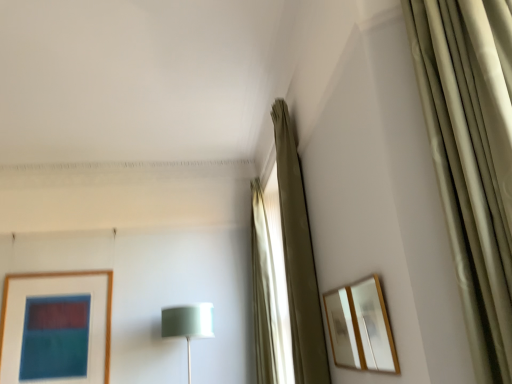
Image resolution: width=512 pixels, height=384 pixels. What do you see at coordinates (263, 291) in the screenshot? I see `beige fabric curtain at center, which ranks as the 1th curtain in back-to-front order` at bounding box center [263, 291].

The height and width of the screenshot is (384, 512). Describe the element at coordinates (298, 257) in the screenshot. I see `beige fabric curtain at upper right, acting as the second curtain starting from the back` at that location.

Find the location of a particular element. This screenshot has height=384, width=512. wooden mirror at upper right, arranged as the 2th picture frame when viewed from the front is located at coordinates (341, 329).

How different are the orientations of wooden-framed mirror at right, the first picture frame positioned from the front, and beige fabric curtain at upper right, acting as the first curtain starting from the front, in degrees?

wooden-framed mirror at right, the first picture frame positioned from the front, and beige fabric curtain at upper right, acting as the first curtain starting from the front, are facing 1.86 degrees away from each other.

Is wooden-framed mirror at right, the first picture frame positioned from the front, to the right of beige fabric curtain at upper right, acting as the first curtain starting from the front, from the viewer's perspective?

Correct, you'll find wooden-framed mirror at right, the first picture frame positioned from the front, to the right of beige fabric curtain at upper right, acting as the first curtain starting from the front.

Which object is further away from the camera taking this photo, wooden-framed mirror at right, the second picture frame positioned from the back, or beige fabric curtain at upper right, acting as the second curtain starting from the back?

beige fabric curtain at upper right, acting as the second curtain starting from the back.

Is point (208, 314) behind point (298, 290)?

Yes, point (208, 314) is behind point (298, 290).

Between satin green shade at center and beige fabric curtain at upper right, acting as the first curtain starting from the front, which one has smaller size?

With smaller size is beige fabric curtain at upper right, acting as the first curtain starting from the front.

Could you tell me if satin green shade at center is facing beige fabric curtain at upper right, acting as the second curtain starting from the back?

No, satin green shade at center is not aimed at beige fabric curtain at upper right, acting as the second curtain starting from the back.

Identify the location of table lamp below the beige fabric curtain at upper right, acting as the first curtain starting from the front (from a real-world perspective). (187, 324).

Where is `table lamp lying on the left of wooden-framed mirror at right, the first picture frame positioned from the front`? table lamp lying on the left of wooden-framed mirror at right, the first picture frame positioned from the front is located at coordinates (187, 324).

Is satin green shade at center behind wooden-framed mirror at right, the first picture frame positioned from the front?

Yes, it is behind wooden-framed mirror at right, the first picture frame positioned from the front.

Can you confirm if satin green shade at center is positioned to the left of wooden-framed mirror at right, the second picture frame positioned from the back?

Yes.

Does point (276, 300) come behind point (186, 321)?

Yes.

From a real-world perspective, which is physically above, beige fabric curtain at center, which ranks as the 1th curtain in back-to-front order, or satin green shade at center?

beige fabric curtain at center, which ranks as the 1th curtain in back-to-front order, from a real-world perspective.

Based on the photo, which of these two, beige fabric curtain at center, which is the second curtain from front to back, or satin green shade at center, is thinner?

beige fabric curtain at center, which is the second curtain from front to back.

Considering the relative sizes of beige fabric curtain at upper right, acting as the second curtain starting from the back, and satin green shade at center in the image provided, is beige fabric curtain at upper right, acting as the second curtain starting from the back, thinner than satin green shade at center?

Correct, the width of beige fabric curtain at upper right, acting as the second curtain starting from the back, is less than that of satin green shade at center.

Between beige fabric curtain at upper right, acting as the first curtain starting from the front, and satin green shade at center, which one has larger size?

satin green shade at center is bigger.

The image size is (512, 384). Identify the location of table lamp that appears below the beige fabric curtain at upper right, acting as the first curtain starting from the front (from the image's perspective). (187, 324).

Is wooden-framed mirror at right, the second picture frame positioned from the back, aimed at satin green shade at center?

No, wooden-framed mirror at right, the second picture frame positioned from the back, is not oriented towards satin green shade at center.

From the image's perspective, is wooden-framed mirror at right, the first picture frame positioned from the front, beneath satin green shade at center?

No.

Which is closer, (380,364) or (196,335)?

The point (380,364) is closer.

Between wooden-framed mirror at right, the first picture frame positioned from the front, and satin green shade at center, which one has smaller width?

wooden-framed mirror at right, the first picture frame positioned from the front.

Which is in front, beige fabric curtain at upper right, acting as the first curtain starting from the front, or wooden mirror at upper right, arranged as the 2th picture frame when viewed from the front?

wooden mirror at upper right, arranged as the 2th picture frame when viewed from the front, is closer to the camera.

Which object is wider, beige fabric curtain at upper right, acting as the first curtain starting from the front, or wooden mirror at upper right, arranged as the 2th picture frame when viewed from the front?

With larger width is beige fabric curtain at upper right, acting as the first curtain starting from the front.

From the image's perspective, is beige fabric curtain at upper right, acting as the second curtain starting from the back, below wooden mirror at upper right, which is the 1th picture frame from back to front?

No, from the image's perspective, beige fabric curtain at upper right, acting as the second curtain starting from the back, is not beneath wooden mirror at upper right, which is the 1th picture frame from back to front.

Which curtain is the 1st one when counting from the back of the wooden-framed mirror at right, the second picture frame positioned from the back? Please provide its 2D coordinates.

[(298, 257)]

Locate an element on the screen. The image size is (512, 384). table lamp that appears on the left of beige fabric curtain at upper right, acting as the second curtain starting from the back is located at coordinates (187, 324).

When comparing their distances from beige fabric curtain at center, which ranks as the 1th curtain in back-to-front order, does wooden mirror at upper right, arranged as the 2th picture frame when viewed from the front, or beige fabric curtain at upper right, acting as the second curtain starting from the back, seem closer?

Among the two, beige fabric curtain at upper right, acting as the second curtain starting from the back, is located nearer to beige fabric curtain at center, which ranks as the 1th curtain in back-to-front order.

Looking at the image, which one is located closer to wooden mirror at upper right, arranged as the 2th picture frame when viewed from the front, beige fabric curtain at upper right, acting as the second curtain starting from the back, or wooden-framed mirror at right, the second picture frame positioned from the back?

The object closer to wooden mirror at upper right, arranged as the 2th picture frame when viewed from the front, is wooden-framed mirror at right, the second picture frame positioned from the back.

Considering their positions, is wooden-framed mirror at right, the first picture frame positioned from the front, positioned further to satin green shade at center than wooden mirror at upper right, arranged as the 2th picture frame when viewed from the front?

Based on the image, wooden-framed mirror at right, the first picture frame positioned from the front, appears to be further to satin green shade at center.

From the image, which object appears to be nearer to beige fabric curtain at upper right, acting as the first curtain starting from the front, wooden-framed mirror at right, the first picture frame positioned from the front, or beige fabric curtain at center, which is the second curtain from front to back?

wooden-framed mirror at right, the first picture frame positioned from the front, lies closer to beige fabric curtain at upper right, acting as the first curtain starting from the front, than the other object.

Considering their positions, is beige fabric curtain at upper right, acting as the second curtain starting from the back, positioned further to satin green shade at center than wooden mirror at upper right, which is the 1th picture frame from back to front?

wooden mirror at upper right, which is the 1th picture frame from back to front, is positioned further to the anchor satin green shade at center.

Considering their positions, is satin green shade at center positioned closer to wooden mirror at upper right, arranged as the 2th picture frame when viewed from the front, than wooden-framed mirror at right, the second picture frame positioned from the back?

wooden-framed mirror at right, the second picture frame positioned from the back.

Based on their spatial positions, is satin green shade at center or wooden-framed mirror at right, the second picture frame positioned from the back, closer to beige fabric curtain at center, which ranks as the 1th curtain in back-to-front order?

The object closer to beige fabric curtain at center, which ranks as the 1th curtain in back-to-front order, is satin green shade at center.

When comparing their distances from beige fabric curtain at upper right, acting as the second curtain starting from the back, does satin green shade at center or beige fabric curtain at center, which ranks as the 1th curtain in back-to-front order, seem further?

beige fabric curtain at center, which ranks as the 1th curtain in back-to-front order, lies further to beige fabric curtain at upper right, acting as the second curtain starting from the back, than the other object.

Where is `picture frame between wooden-framed mirror at right, the second picture frame positioned from the back, and beige fabric curtain at upper right, acting as the first curtain starting from the front, in the front-back direction`? This screenshot has height=384, width=512. picture frame between wooden-framed mirror at right, the second picture frame positioned from the back, and beige fabric curtain at upper right, acting as the first curtain starting from the front, in the front-back direction is located at coordinates (341, 329).

The image size is (512, 384). Find the location of `picture frame located between wooden-framed mirror at right, the second picture frame positioned from the back, and satin green shade at center in the depth direction`. picture frame located between wooden-framed mirror at right, the second picture frame positioned from the back, and satin green shade at center in the depth direction is located at coordinates (341, 329).

At what (x,y) coordinates should I click in order to perform the action: click on curtain positioned between wooden-framed mirror at right, the first picture frame positioned from the front, and beige fabric curtain at center, which ranks as the 1th curtain in back-to-front order, from near to far. Please return your answer as a coordinate pair (x, y). The image size is (512, 384). Looking at the image, I should click on (298, 257).

Where is `curtain located between wooden mirror at upper right, which is the 1th picture frame from back to front, and satin green shade at center in the depth direction`? The image size is (512, 384). curtain located between wooden mirror at upper right, which is the 1th picture frame from back to front, and satin green shade at center in the depth direction is located at coordinates (298, 257).